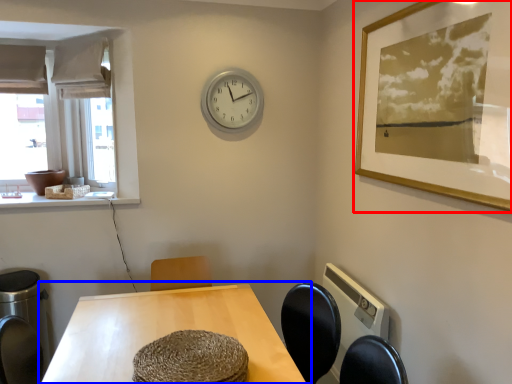
Question: Which object appears farthest to the camera in this image, picture frame (highlighted by a red box) or table (highlighted by a blue box)?

Choices:
 (A) picture frame
 (B) table

Answer: (B)